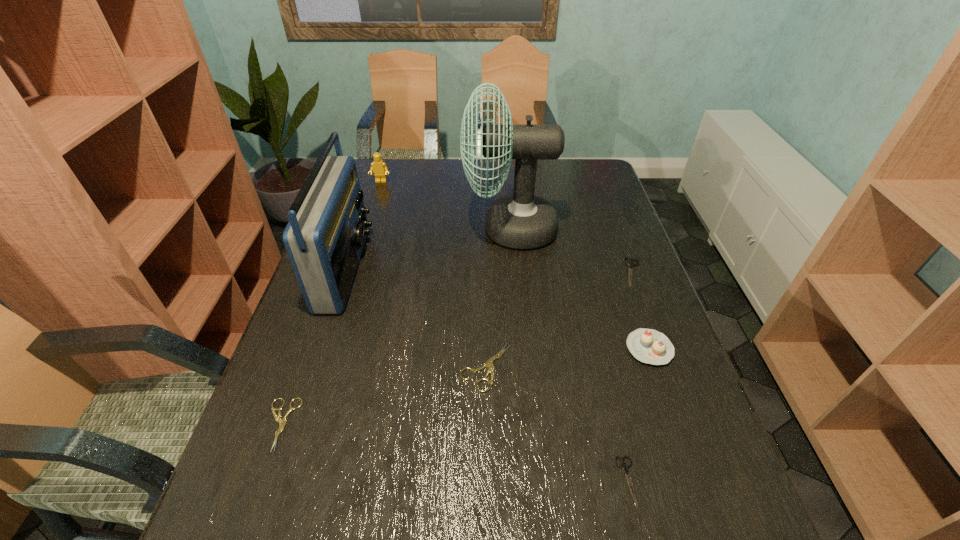
Where is `the leftmost shears`? Image resolution: width=960 pixels, height=540 pixels. the leftmost shears is located at coordinates (282, 421).

I want to click on the smaller beige shears, so click(x=282, y=421).

Identify the location of the smaller black shears. This screenshot has height=540, width=960. (624, 466).

This screenshot has width=960, height=540. In order to click on the third shears from left to right in this screenshot , I will do coord(624,466).

Find the location of a particular element. This screenshot has height=540, width=960. free space located 0.140m in front of the fan where the airflow is directed is located at coordinates (419, 229).

The image size is (960, 540). I want to click on free space located in front of the fan where the airflow is directed, so click(391, 229).

I want to click on free space located in front of the fan where the airflow is directed, so 365,229.

Where is `free space located 0.370m on the front panel of the radio receiver`? free space located 0.370m on the front panel of the radio receiver is located at coordinates (494, 268).

Locate an element on the screen. The image size is (960, 540). vacant space located on the face of the farthest object is located at coordinates (360, 247).

Identify the location of vacant space located on the back of the fifth shortest object. The height and width of the screenshot is (540, 960). (630, 293).